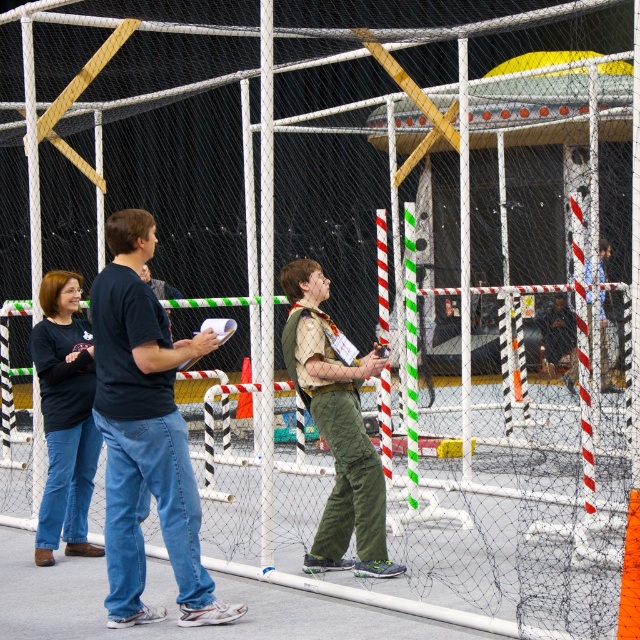
You are a visitor in this sports facility and want to take a photo of the khaki uniform at center and the matte black shirt at left. Which one should you focus on first if you want to capture both in the same frame without moving the camera?

The khaki uniform at center is located above the matte black shirt at left, so you should focus on the matte black shirt at left first to ensure both are in the frame.

You are a photographer positioned outside the netted enclosure. You need to capture a photo of both the dark blue shirt at center and the matte black shirt at left. Based on their positions and heights, which person should you focus on first to ensure both are in frame?

The dark blue shirt at center is taller than the matte black shirt at left. To ensure both are in frame, focus on the dark blue shirt at center first as it occupies a higher position, allowing the shorter matte black shirt at left to naturally fall into the shot.

You are standing outside the netted enclosure in the sports facility and see two people inside the enclosure. One is wearing a dark blue shirt at center and the other a khaki uniform at center. From your perspective outside, which person is positioned to the right?

The khaki uniform at center is positioned to the right because the dark blue shirt at center is to the left of it.